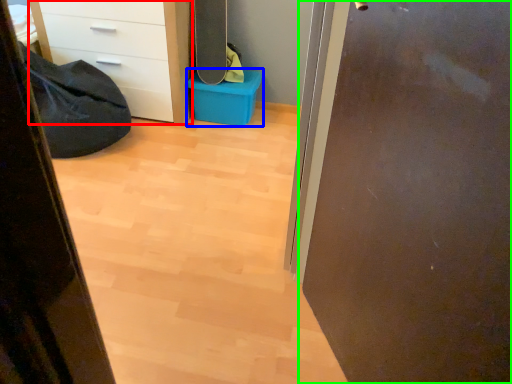
Question: Considering the real-world distances, which object is closest to chest of drawers (highlighted by a red box)? storage box (highlighted by a blue box) or door (highlighted by a green box).

Choices:
 (A) storage box
 (B) door

Answer: (A)